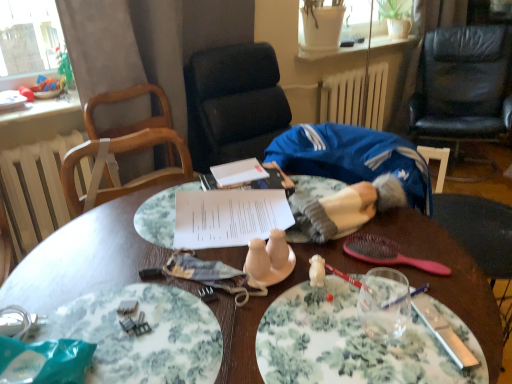
This screenshot has height=384, width=512. Find the location of `vacant space in between silver metallic knife at lower right and white ceramic salt and pepper shakers at center`. vacant space in between silver metallic knife at lower right and white ceramic salt and pepper shakers at center is located at coordinates (356, 312).